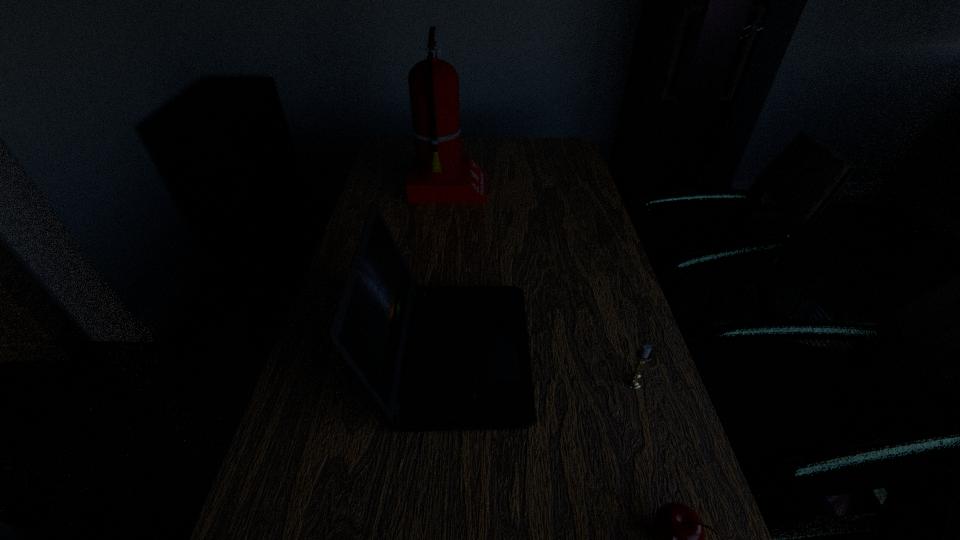
The image size is (960, 540). In the image, there is a desktop. In order to click on vacant space at the far edge in this screenshot , I will do `click(491, 144)`.

I want to click on vacant space at the left edge of the desktop, so click(407, 224).

In the image, there is a desktop. Where is `blank space at the right edge`? The height and width of the screenshot is (540, 960). blank space at the right edge is located at coordinates (552, 204).

Identify the location of vacant space at the far right corner of the desktop. (575, 162).

Identify the location of empty space between the farthest object and the second shortest object. Image resolution: width=960 pixels, height=540 pixels. (541, 286).

Where is `free space between the second shortest object and the farthest object`? The width and height of the screenshot is (960, 540). free space between the second shortest object and the farthest object is located at coordinates (541, 286).

Find the location of `free space between the candle holder and the tallest object`. free space between the candle holder and the tallest object is located at coordinates (541, 286).

The height and width of the screenshot is (540, 960). Find the location of `free spot between the farthest object and the candle holder`. free spot between the farthest object and the candle holder is located at coordinates (541, 286).

This screenshot has width=960, height=540. Find the location of `free space between the candle holder and the third shortest object`. free space between the candle holder and the third shortest object is located at coordinates (543, 368).

At what (x,y) coordinates should I click in order to perform the action: click on free space between the tallest object and the candle holder. Please return your answer as a coordinate pair (x, y). The image size is (960, 540). Looking at the image, I should click on (541, 286).